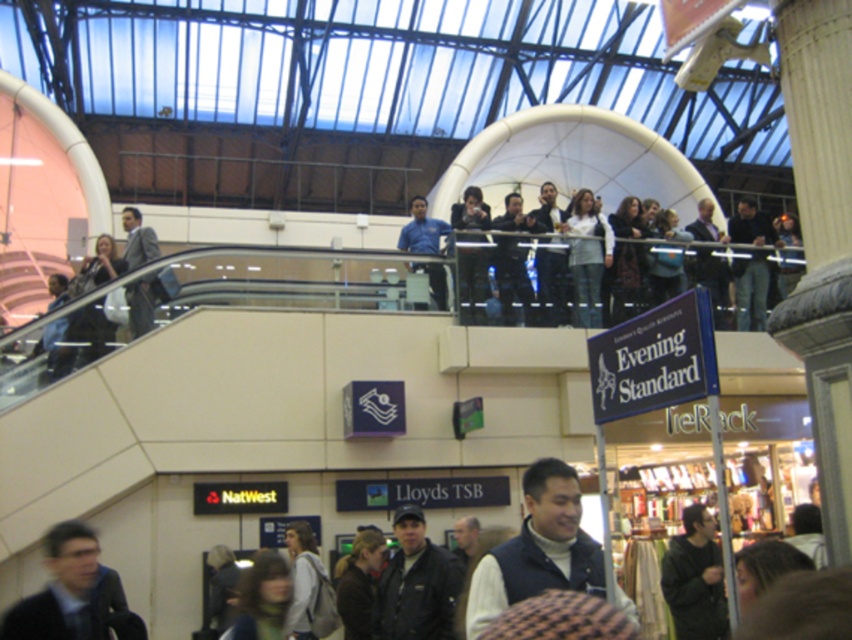
Question: Does black leather jacket at center have a lesser width compared to blue shirt at upper center?

Choices:
 (A) no
 (B) yes

Answer: (B)

Question: Which object appears closest to the camera in this image?

Choices:
 (A) dark blue jeans at upper center
 (B) matte gray suit at left
 (C) blue shirt at upper center

Answer: (B)

Question: From the image, what is the correct spatial relationship of dark blue vest at center in relation to dark blue suit at lower left?

Choices:
 (A) above
 (B) below

Answer: (A)

Question: Does dark blue jeans at upper center have a greater width compared to matte gray suit at left?

Choices:
 (A) no
 (B) yes

Answer: (B)

Question: Estimate the real-world distances between objects in this image. Which object is farther from the black leather jacket at center?

Choices:
 (A) dark blue jeans at upper center
 (B) dark blue vest at center
 (C) blue shirt at upper center
 (D) dark blue suit at lower left

Answer: (A)

Question: Estimate the real-world distances between objects in this image. Which object is farther from the black leather jacket at center?

Choices:
 (A) dark blue suit at lower left
 (B) blue shirt at upper center
 (C) dark blue vest at center

Answer: (B)